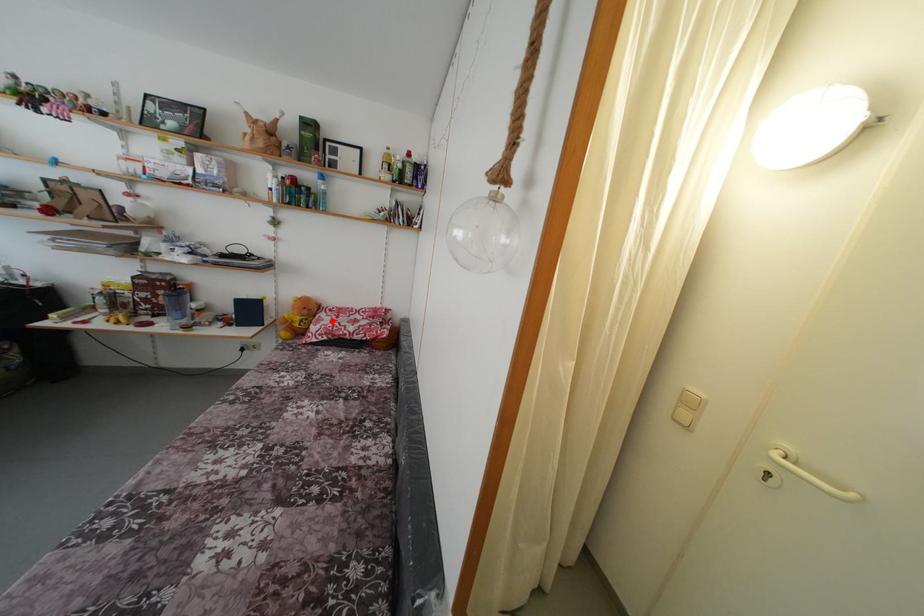
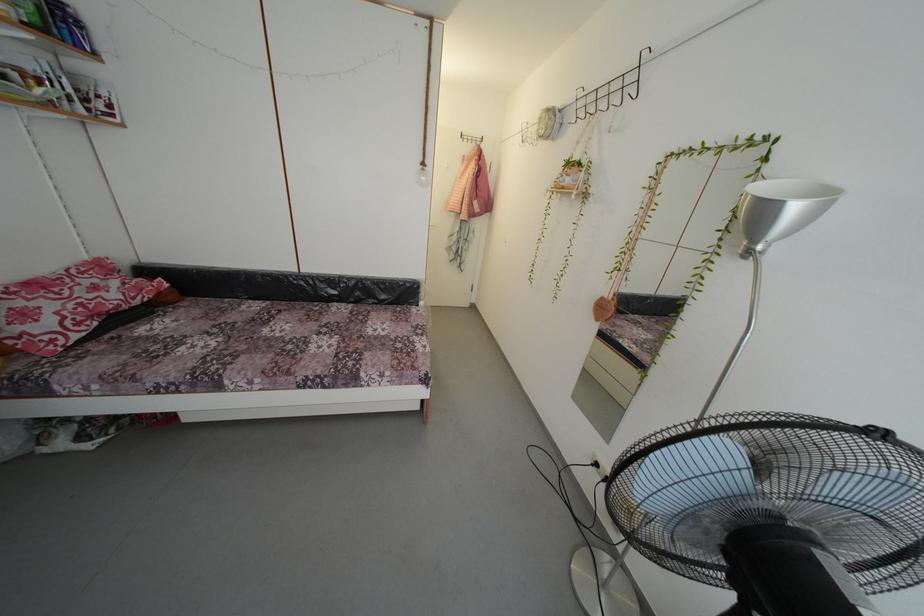
Locate, in the second image, the point that corresponds to the highlighted location in the first image.

(34, 306)